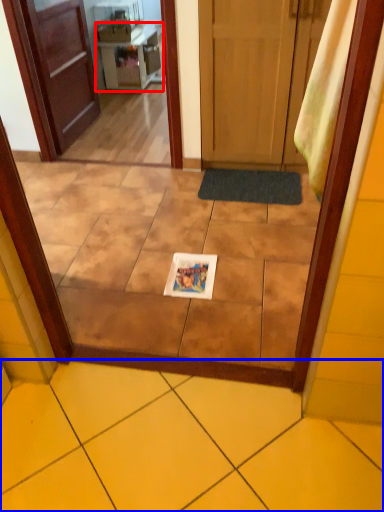
Question: Which point is closer to the camera, vanity (highlighted by a red box) or ceramic tile (highlighted by a blue box)?

Choices:
 (A) vanity
 (B) ceramic tile

Answer: (B)